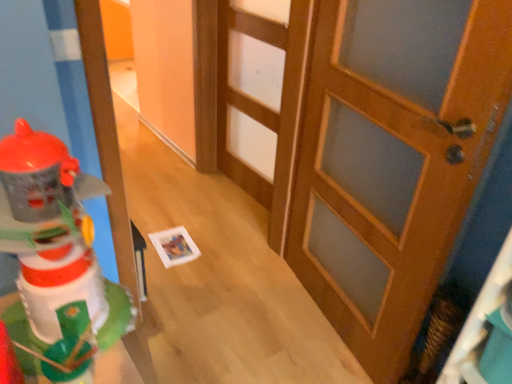
Question: In which direction should I rotate to look at wooden door at center, the 2th door positioned from the front?

Choices:
 (A) left
 (B) right

Answer: (A)

Question: From the image's perspective, is plastic toy robot at left on wooden door at center, the second door viewed from the right?

Choices:
 (A) yes
 (B) no

Answer: (B)

Question: From a real-world perspective, is plastic toy robot at left on wooden door at center, the 1th door from the back?

Choices:
 (A) yes
 (B) no

Answer: (A)

Question: Is plastic toy robot at left completely or partially outside of wooden door at center, the 1th door from the back?

Choices:
 (A) no
 (B) yes

Answer: (B)

Question: Is plastic toy robot at left positioned before wooden door at center, the 1th door from the back?

Choices:
 (A) yes
 (B) no

Answer: (A)

Question: Is plastic toy robot at left oriented towards wooden door at center, the 1th door viewed from the left?

Choices:
 (A) no
 (B) yes

Answer: (A)

Question: Could wooden door at center, the 2th door positioned from the front, be considered to be inside plastic toy robot at left?

Choices:
 (A) yes
 (B) no

Answer: (B)

Question: Is wooden door at center, arranged as the 1th door when viewed from the right, thinner than plastic toy robot at left?

Choices:
 (A) no
 (B) yes

Answer: (B)

Question: Is wooden door at center, the first door in the front-to-back sequence, not close to plastic toy robot at left?

Choices:
 (A) no
 (B) yes

Answer: (B)

Question: From the image's perspective, is wooden door at center, arranged as the 1th door when viewed from the right, on plastic toy robot at left?

Choices:
 (A) yes
 (B) no

Answer: (A)

Question: From the image's perspective, is wooden door at center, placed as the 2th door when sorted from back to front, under plastic toy robot at left?

Choices:
 (A) yes
 (B) no

Answer: (B)

Question: From a real-world perspective, is wooden door at center, arranged as the 1th door when viewed from the right, physically above plastic toy robot at left?

Choices:
 (A) no
 (B) yes

Answer: (A)

Question: Considering the relative sizes of wooden door at center, which is counted as the 2th door, starting from the left, and plastic toy robot at left in the image provided, is wooden door at center, which is counted as the 2th door, starting from the left, shorter than plastic toy robot at left?

Choices:
 (A) no
 (B) yes

Answer: (A)

Question: Does wooden door at center, the 2th door positioned from the front, appear on the left side of plastic toy robot at left?

Choices:
 (A) yes
 (B) no

Answer: (B)